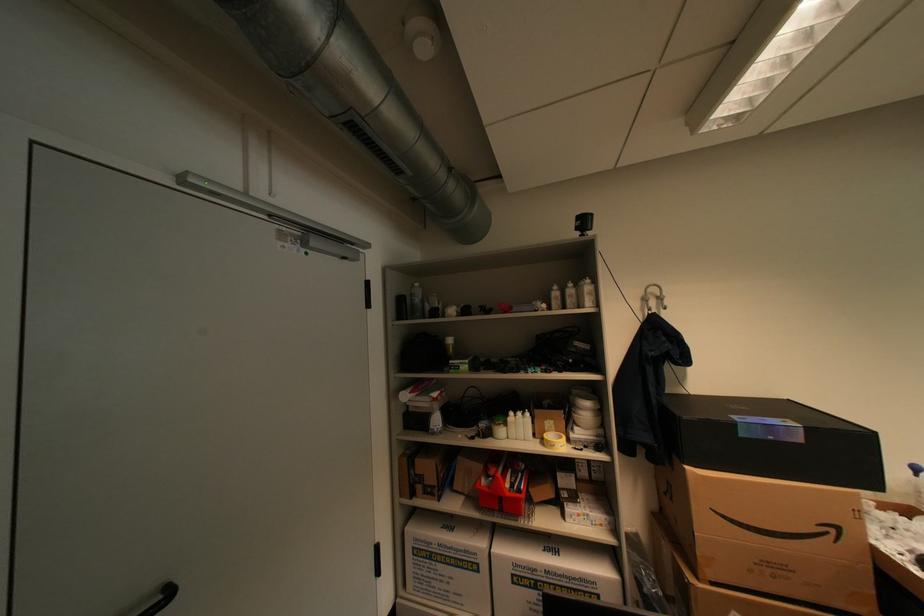
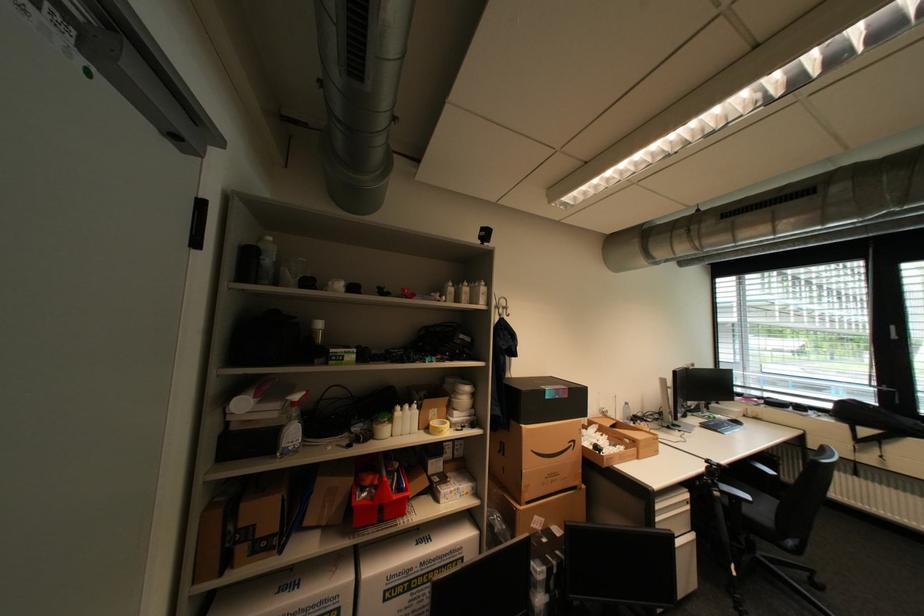
Question: The images are taken continuously from a first-person perspective. In which direction is your viewpoint rotating?

Choices:
 (A) Left
 (B) Right
 (C) Up
 (D) Down

Answer: (B)